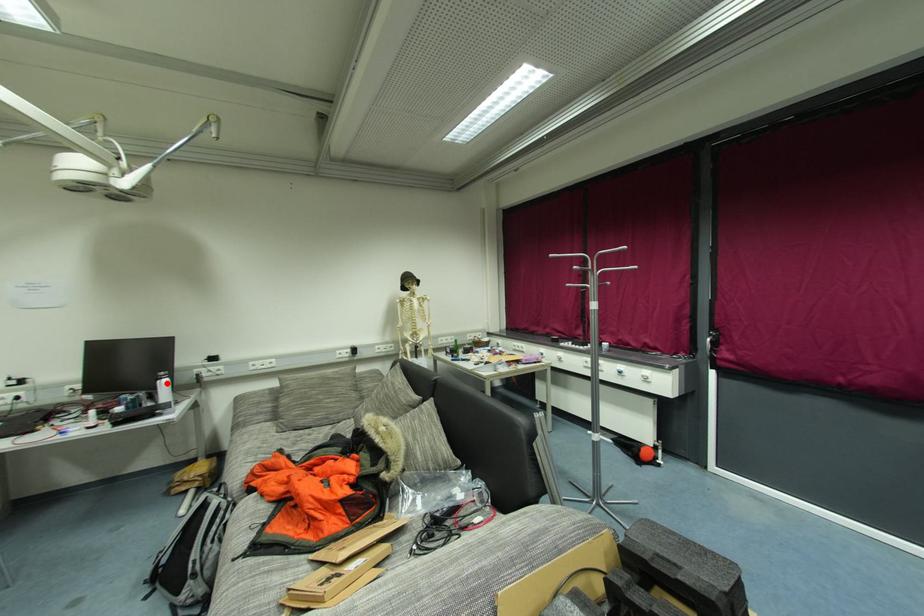
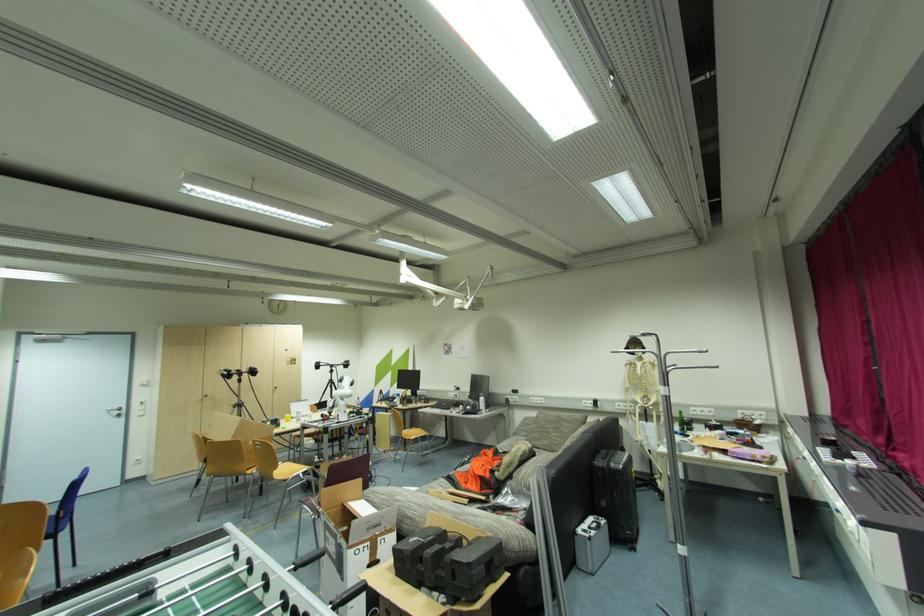
The point at the highlighted location is marked in the first image. Where is the corresponding point in the second image?

(484, 400)